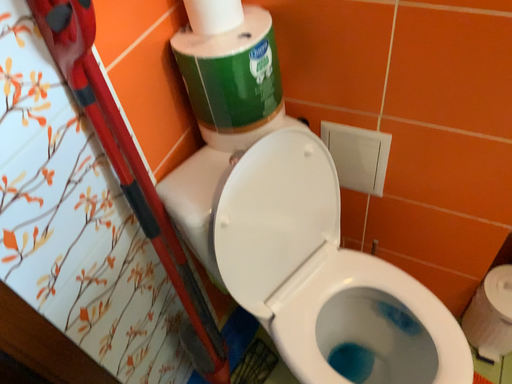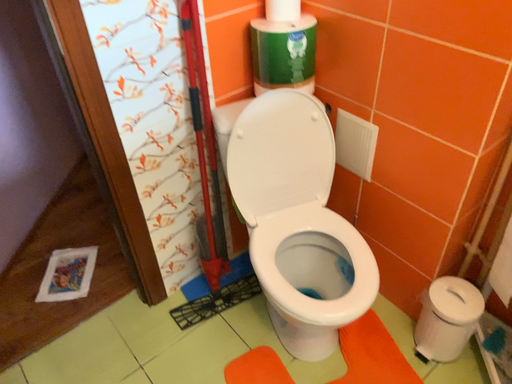
Question: How did the camera likely rotate when shooting the video?

Choices:
 (A) rotated upward
 (B) rotated downward

Answer: (A)